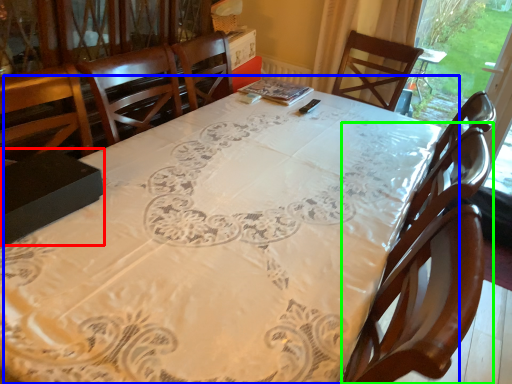
Question: Which object is positioned closest to box (highlighted by a red box)? Select from table (highlighted by a blue box) and chair (highlighted by a green box).

Choices:
 (A) table
 (B) chair

Answer: (A)